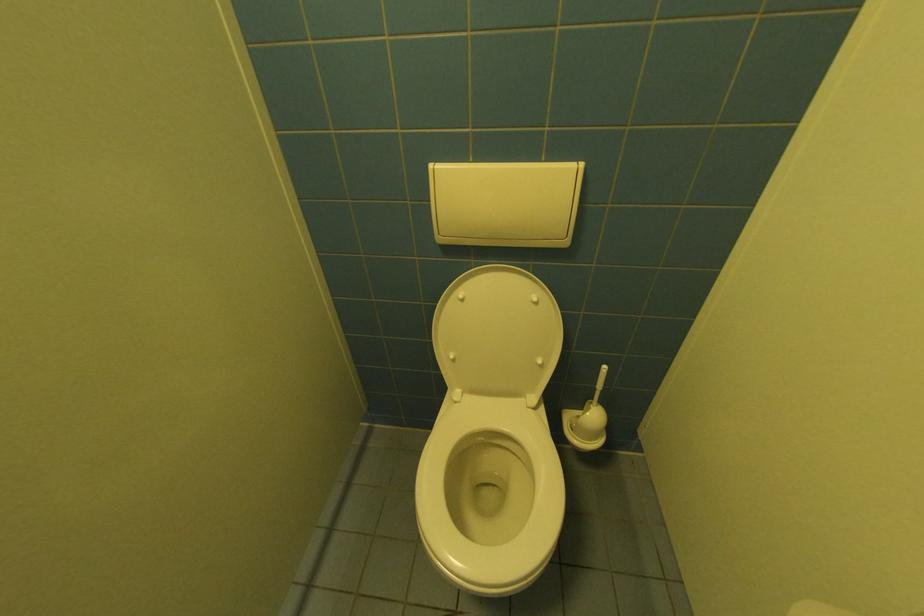
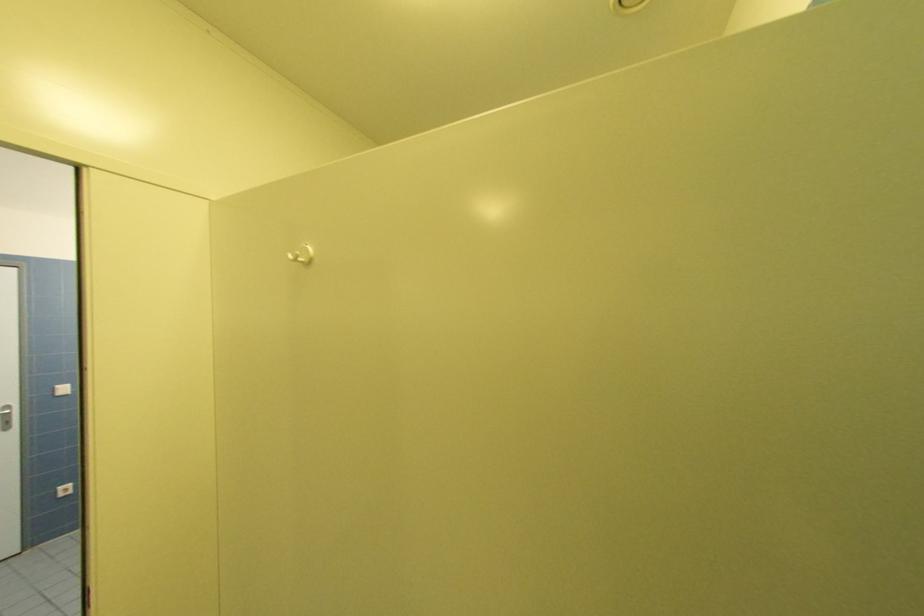
Question: The images are taken continuously from a first-person perspective. In which direction is your viewpoint rotating?

Choices:
 (A) Left
 (B) Right
 (C) Up
 (D) Down

Answer: (A)